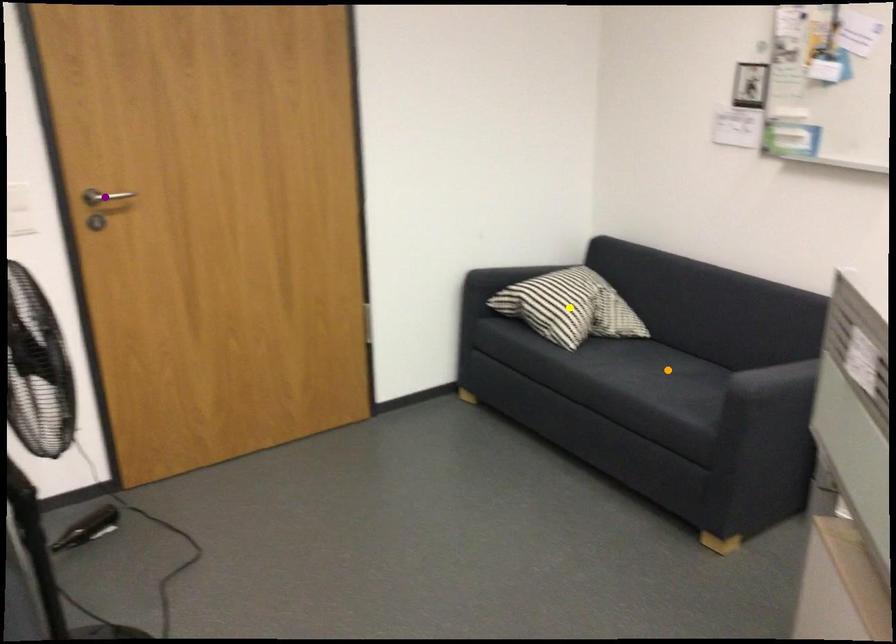
Consider the image. Order these from nearest to farthest:
orange point, purple point, yellow point

1. purple point
2. orange point
3. yellow point